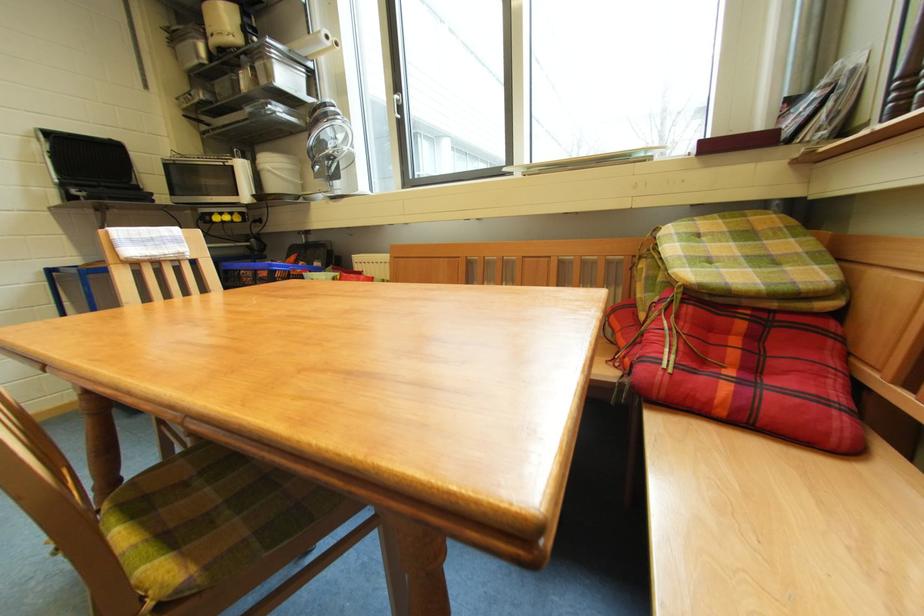
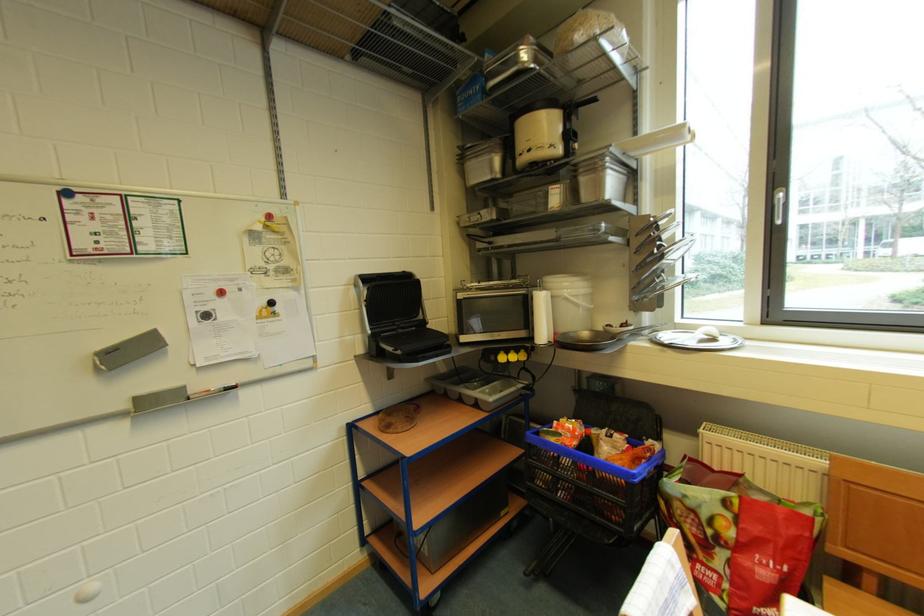
Where in the second image is the point corresponding to the point at 215,221 from the first image?

(500, 361)